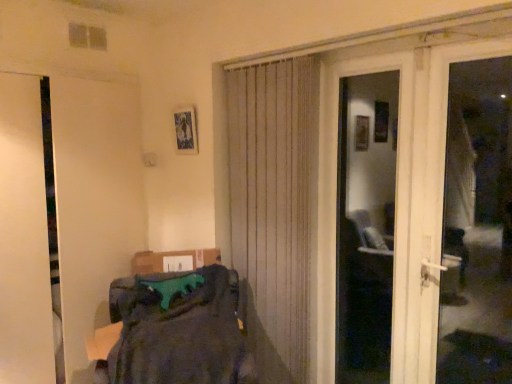
Question: Can you confirm if beige textured curtain at center is bigger than white glossy door at center, the 1th door from the right?

Choices:
 (A) no
 (B) yes

Answer: (B)

Question: Is beige textured curtain at center wider than white glossy door at center, arranged as the second door when viewed from the left?

Choices:
 (A) yes
 (B) no

Answer: (A)

Question: Does beige textured curtain at center come behind white glossy door at center, arranged as the second door when viewed from the left?

Choices:
 (A) yes
 (B) no

Answer: (A)

Question: Could you tell me if beige textured curtain at center is facing white glossy door at center, the 1th door from the right?

Choices:
 (A) no
 (B) yes

Answer: (A)

Question: Is beige textured curtain at center to the right of white glossy door at center, the 1th door from the right, from the viewer's perspective?

Choices:
 (A) yes
 (B) no

Answer: (B)

Question: Is dark gray fabric at lower left inside the boundaries of metallic silver picture frame at upper center, or outside?

Choices:
 (A) inside
 (B) outside

Answer: (B)

Question: From the image's perspective, relative to metallic silver picture frame at upper center, is dark gray fabric at lower left above or below?

Choices:
 (A) below
 (B) above

Answer: (A)

Question: Is dark gray fabric at lower left taller or shorter than metallic silver picture frame at upper center?

Choices:
 (A) tall
 (B) short

Answer: (A)

Question: In terms of size, does dark gray fabric at lower left appear bigger or smaller than metallic silver picture frame at upper center?

Choices:
 (A) small
 (B) big

Answer: (B)

Question: Based on their positions, is white glossy door at center, the 1th door from the right, located to the left or right of white plastic door handle at right?

Choices:
 (A) right
 (B) left

Answer: (B)

Question: From the image's perspective, is white glossy door at center, arranged as the second door when viewed from the left, above or below white plastic door handle at right?

Choices:
 (A) above
 (B) below

Answer: (B)

Question: In terms of width, does white glossy door at center, the 1th door from the right, look wider or thinner when compared to white plastic door handle at right?

Choices:
 (A) wide
 (B) thin

Answer: (B)

Question: Based on their sizes in the image, would you say white glossy door at center, arranged as the second door when viewed from the left, is bigger or smaller than white plastic door handle at right?

Choices:
 (A) big
 (B) small

Answer: (B)

Question: In terms of height, does metallic silver picture frame at upper center look taller or shorter compared to beige textured curtain at center?

Choices:
 (A) short
 (B) tall

Answer: (A)

Question: Considering the positions of metallic silver picture frame at upper center and beige textured curtain at center in the image, is metallic silver picture frame at upper center bigger or smaller than beige textured curtain at center?

Choices:
 (A) small
 (B) big

Answer: (A)